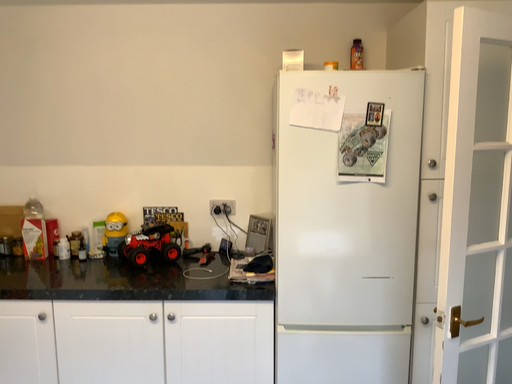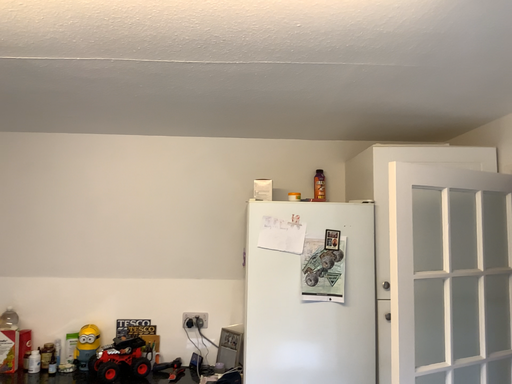
Question: Which way did the camera rotate in the video?

Choices:
 (A) rotated upward
 (B) rotated downward

Answer: (A)